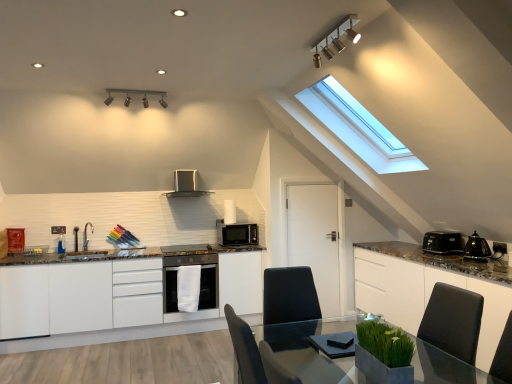
The width and height of the screenshot is (512, 384). Describe the element at coordinates (200, 285) in the screenshot. I see `black matte oven at center` at that location.

Identify the location of matte black microwave at center, arranged as the first kitchen appliance when viewed from the right. This screenshot has width=512, height=384. (236, 234).

What is the approximate width of matte silver light fixture at upper center, which is counted as the 2th light fixture, starting from the right?

It is 3.52 inches.

Find the location of a particular element. The height and width of the screenshot is (384, 512). clear glass table at center is located at coordinates (310, 349).

What is the approximate width of white glossy cabinet at right, the 1th cabinetry in the right-to-left sequence?

24.59 inches.

Where is `satin silver range hood at upper center, marked as the 1th kitchen appliance in a top-to-bottom arrangement`? The image size is (512, 384). satin silver range hood at upper center, marked as the 1th kitchen appliance in a top-to-bottom arrangement is located at coordinates (186, 185).

From the image's perspective, is white glossy cabinet at right, which ranks as the second cabinetry in left-to-right order, positioned above or below matte black microwave at center, arranged as the first kitchen appliance when viewed from the right?

From the image's perspective, white glossy cabinet at right, which ranks as the second cabinetry in left-to-right order, appears below matte black microwave at center, arranged as the first kitchen appliance when viewed from the right.

Between point (412, 287) and point (232, 224), which one is positioned behind?

Point (232, 224)

Is white glossy cabinet at right, the 1th cabinetry in the right-to-left sequence, completely or partially outside of matte black microwave at center, acting as the 2th kitchen appliance starting from the left?

Yes, white glossy cabinet at right, the 1th cabinetry in the right-to-left sequence, is outside of matte black microwave at center, acting as the 2th kitchen appliance starting from the left.

Is white glossy cabinet at right, the 1th cabinetry in the right-to-left sequence, far from matte black microwave at center, acting as the 2th kitchen appliance starting from the left?

Indeed, white glossy cabinet at right, the 1th cabinetry in the right-to-left sequence, is not near matte black microwave at center, acting as the 2th kitchen appliance starting from the left.

From a real-world perspective, is clear glass table at center above or below black matte oven at center?

clear glass table at center is situated lower than black matte oven at center in the real world.

Which object is thinner, clear glass table at center or black matte oven at center?

Thinner between the two is black matte oven at center.

Based on the photo, is clear glass table at center not within black matte oven at center?

Absolutely, clear glass table at center is external to black matte oven at center.

Which is in front, clear glass table at center or black matte oven at center?

clear glass table at center.

Is black plastic toaster at right, which is the 1th appliance from back to front, inside or outside of metallic track lights at upper center, acting as the first light fixture starting from the right?

black plastic toaster at right, which is the 1th appliance from back to front, is spatially situated outside metallic track lights at upper center, acting as the first light fixture starting from the right.

Looking at the image, does black plastic toaster at right, which is the 1th appliance from back to front, seem bigger or smaller compared to metallic track lights at upper center, acting as the first light fixture starting from the front?

In the image, black plastic toaster at right, which is the 1th appliance from back to front, appears to be larger than metallic track lights at upper center, acting as the first light fixture starting from the front.

What's the angular difference between black plastic toaster at right, which is the 1th appliance from back to front, and metallic track lights at upper center, which appears as the 2th light fixture when viewed from the back,'s facing directions?

The facing directions of black plastic toaster at right, which is the 1th appliance from back to front, and metallic track lights at upper center, which appears as the 2th light fixture when viewed from the back, are 2.39 degrees apart.

From the image's perspective, between metallic track lights at upper center, acting as the first light fixture starting from the front, and clear glass table at center, who is located below?

clear glass table at center, from the image's perspective.

Considering the sizes of metallic track lights at upper center, acting as the first light fixture starting from the front, and clear glass table at center in the image, is metallic track lights at upper center, acting as the first light fixture starting from the front, wider or thinner than clear glass table at center?

Clearly, metallic track lights at upper center, acting as the first light fixture starting from the front, has less width compared to clear glass table at center.

Between metallic track lights at upper center, acting as the first light fixture starting from the right, and clear glass table at center, which one has more height?

clear glass table at center.

Is metallic track lights at upper center, which appears as the 2th light fixture when viewed from the back, oriented towards clear glass table at center?

No, metallic track lights at upper center, which appears as the 2th light fixture when viewed from the back, is not turned towards clear glass table at center.

Which appliance is the 2nd one when counting from the back of the clear glass table at center? Please provide its 2D coordinates.

[(443, 242)]

Which is correct: black plastic toaster at right, which is the 1th appliance from back to front, is inside clear glass table at center, or outside of it?

black plastic toaster at right, which is the 1th appliance from back to front, lies outside clear glass table at center.

From a real-world perspective, between black plastic toaster at right, which is the 1th appliance from back to front, and clear glass table at center, who is vertically lower?

In real-world perspective, clear glass table at center is lower.

Which object is more forward, black plastic toaster at right, the 2th appliance in the front-to-back sequence, or clear glass table at center?

clear glass table at center.

Considering the relative sizes of black plastic toaster at right, the 1th appliance from the front, and black plastic toaster at right, which is the 1th appliance from back to front, in the image provided, is black plastic toaster at right, the 1th appliance from the front, bigger than black plastic toaster at right, which is the 1th appliance from back to front,?

Incorrect, black plastic toaster at right, the 1th appliance from the front, is not larger than black plastic toaster at right, which is the 1th appliance from back to front.

Locate an element on the screen. Image resolution: width=512 pixels, height=384 pixels. appliance lying below the black plastic toaster at right, the 2th appliance in the front-to-back sequence (from the image's perspective) is located at coordinates (477, 248).

Is black plastic toaster at right, the 2th appliance viewed from the back, with black plastic toaster at right, which is the 1th appliance from back to front?

No.

What's the angular difference between black plastic toaster at right, the 2th appliance viewed from the back, and black plastic toaster at right, which is the 1th appliance from back to front,'s facing directions?

The angular difference between black plastic toaster at right, the 2th appliance viewed from the back, and black plastic toaster at right, which is the 1th appliance from back to front, is 0.566 degrees.

From a real-world perspective, which object stands above the other?

From a 3D spatial view, matte silver light fixture at upper center, the 1th light fixture viewed from the back, is above.

Is matte silver light fixture at upper center, which is counted as the 2th light fixture, starting from the right, positioned with its back to black plastic toaster at right, the 1th appliance from the front?

That's not correct — matte silver light fixture at upper center, which is counted as the 2th light fixture, starting from the right, is not looking away from black plastic toaster at right, the 1th appliance from the front.

Is point (160, 102) farther from camera compared to point (477, 256)?

Yes, point (160, 102) is farther from viewer.

From the image's perspective, starting from the white glossy cabinet at right, which ranks as the second cabinetry in left-to-right order, which kitchen appliance is the 1st one above? Please provide its 2D coordinates.

[(236, 234)]

The height and width of the screenshot is (384, 512). I want to click on table below the black matte oven at center (from a real-world perspective), so click(310, 349).

From the image, which object appears to be farther from black plastic toaster at right, the 2th appliance viewed from the back, matte silver light fixture at upper center, the 1th light fixture viewed from the back, or white glossy cabinet at right, the 1th cabinetry in the right-to-left sequence?

The object further to black plastic toaster at right, the 2th appliance viewed from the back, is matte silver light fixture at upper center, the 1th light fixture viewed from the back.

From the image, which object appears to be nearer to clear glass table at center, black plastic toaster at right, the 2th appliance viewed from the back, or black plastic toaster at right, which is the 1th appliance from back to front?

black plastic toaster at right, which is the 1th appliance from back to front, is positioned closer to the anchor clear glass table at center.

Looking at the image, which one is located closer to metallic track lights at upper center, which is the 2th light fixture from left to right, matte silver light fixture at upper center, the 1th light fixture viewed from the left, or white glossy cabinet at right, the 1th cabinetry in the right-to-left sequence?

Based on the image, matte silver light fixture at upper center, the 1th light fixture viewed from the left, appears to be nearer to metallic track lights at upper center, which is the 2th light fixture from left to right.

Considering their positions, is white glossy cabinet at right, which ranks as the second cabinetry in left-to-right order, positioned further to black plastic toaster at right, the 2th appliance viewed from the back, than metallic track lights at upper center, acting as the first light fixture starting from the front?

Answer: metallic track lights at upper center, acting as the first light fixture starting from the front, is further to black plastic toaster at right, the 2th appliance viewed from the back.

Which object lies further to the anchor point white glossy cabinets at center, acting as the 1th cabinetry starting from the left, black matte oven at center or clear glass table at center?

clear glass table at center.

Which object lies further to the anchor point black plastic toaster at right, which is the 1th appliance from back to front, metallic track lights at upper center, acting as the first light fixture starting from the right, or white glossy cabinet at right, the 1th cabinetry in the right-to-left sequence?

metallic track lights at upper center, acting as the first light fixture starting from the right.

Which object lies further to the anchor point matte black microwave at center, acting as the 2th kitchen appliance starting from the left, metallic track lights at upper center, which is the 2th light fixture from left to right, or matte silver light fixture at upper center, which is the second light fixture in front-to-back order?

Among the two, metallic track lights at upper center, which is the 2th light fixture from left to right, is located further to matte black microwave at center, acting as the 2th kitchen appliance starting from the left.

Looking at the image, which one is located further to white glossy cabinets at center, placed as the 2th cabinetry when sorted from right to left, black matte oven at center or matte black microwave at center, which is the 2th kitchen appliance from top to bottom?

matte black microwave at center, which is the 2th kitchen appliance from top to bottom, lies further to white glossy cabinets at center, placed as the 2th cabinetry when sorted from right to left, than the other object.

You are a GUI agent. You are given a task and a screenshot of the screen. Output one action in this format:
    pyautogui.click(x=<x>, y=<y>)
    Task: Click on the light fixture between black matte oven at center and black plastic toaster at right, which is the 1th appliance from back to front, in the horizontal direction
    Image resolution: width=512 pixels, height=384 pixels.
    Given the screenshot: What is the action you would take?
    pyautogui.click(x=336, y=39)

Where is `appliance between satin silver range hood at upper center, acting as the 2th kitchen appliance starting from the right, and black plastic toaster at right, the 2th appliance viewed from the back, from left to right`? appliance between satin silver range hood at upper center, acting as the 2th kitchen appliance starting from the right, and black plastic toaster at right, the 2th appliance viewed from the back, from left to right is located at coordinates (443, 242).

Image resolution: width=512 pixels, height=384 pixels. Find the location of `light fixture located between black matte oven at center and white glossy cabinet at right, which ranks as the second cabinetry in left-to-right order, in the left-right direction`. light fixture located between black matte oven at center and white glossy cabinet at right, which ranks as the second cabinetry in left-to-right order, in the left-right direction is located at coordinates (336, 39).

Where is `cabinetry located between white glossy cabinets at center, acting as the 1th cabinetry starting from the left, and black plastic toaster at right, the 2th appliance viewed from the back, in the left-right direction`? The image size is (512, 384). cabinetry located between white glossy cabinets at center, acting as the 1th cabinetry starting from the left, and black plastic toaster at right, the 2th appliance viewed from the back, in the left-right direction is located at coordinates (424, 294).